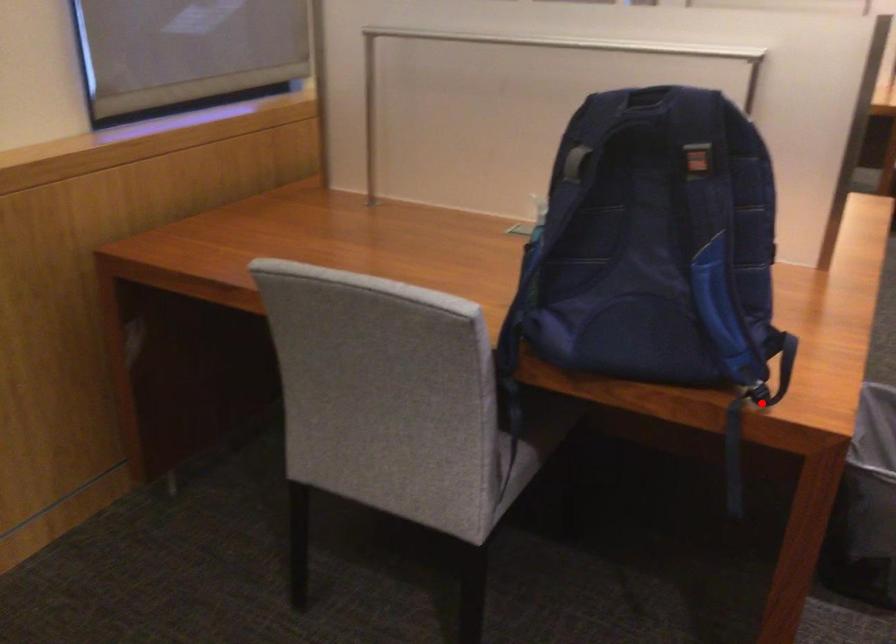
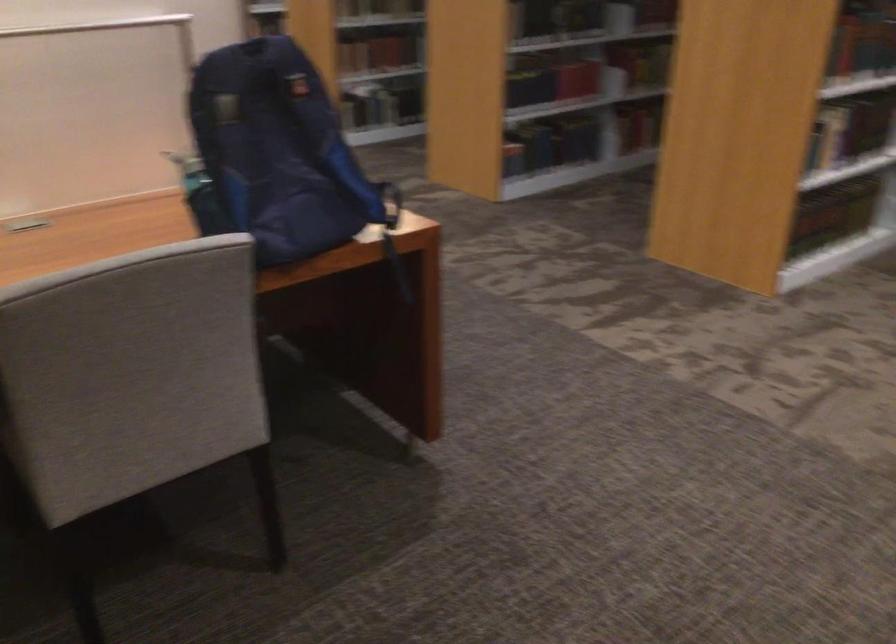
Where in the second image is the point corresponding to the highlighted location from the first image?

(392, 234)